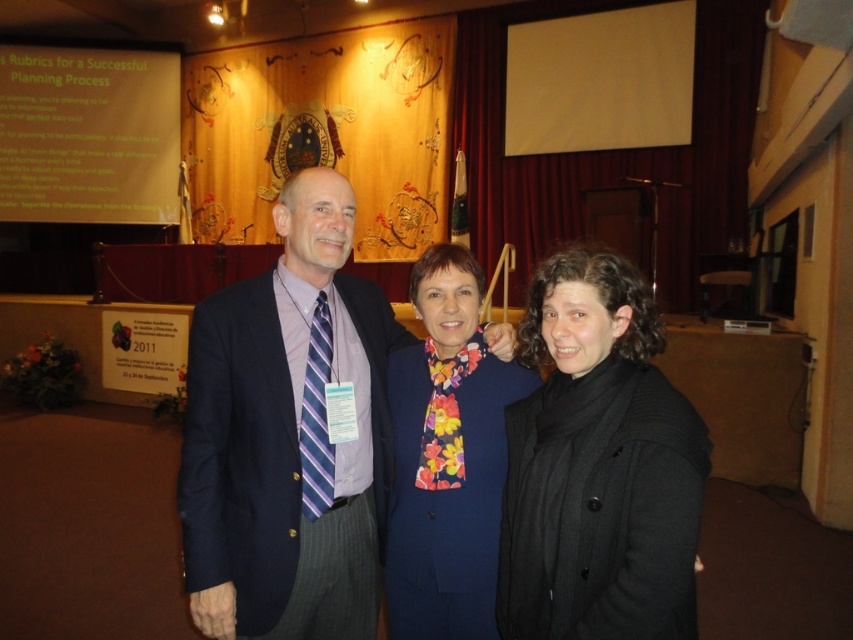
What is located at the coordinates point (88, 134) in the image?

At point (88, 134) lies white paper at upper left.

You are an event photographer at this conference. You need to capture a clear photo of the dark blue suit at center and the black wool coat at center. Which one is closer to the camera?

The dark blue suit at center is closer to the camera because the black wool coat at center is behind it.